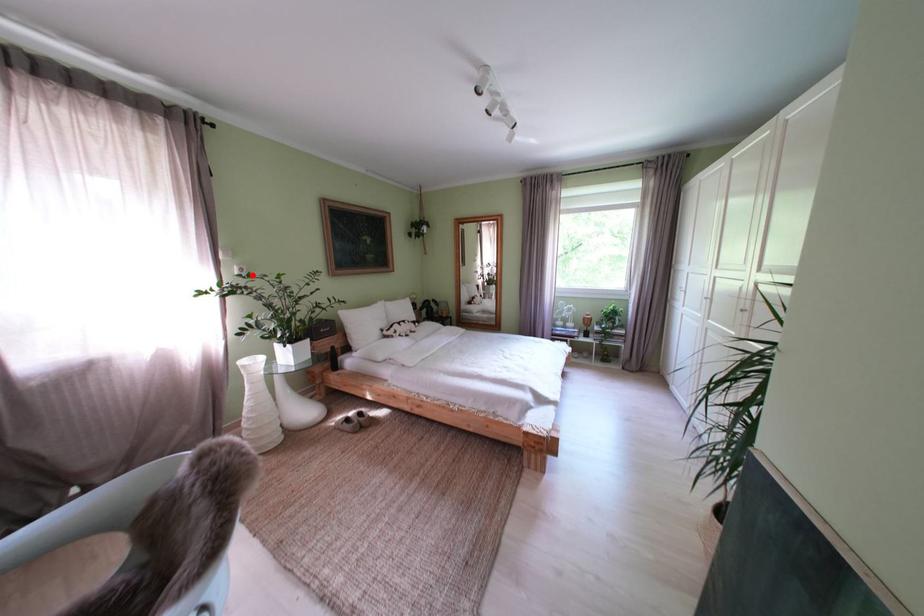
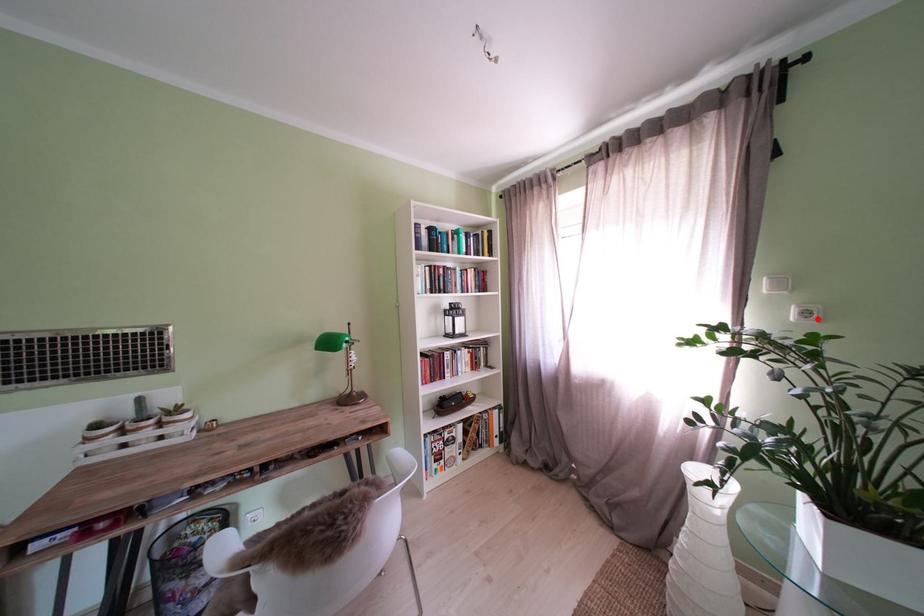
I am providing you with two images of the same scene from different viewpoints. A red point is marked on the first image and another point is marked on the second image. Is the red point in image1 aligned with the point shown in image2?

Yes